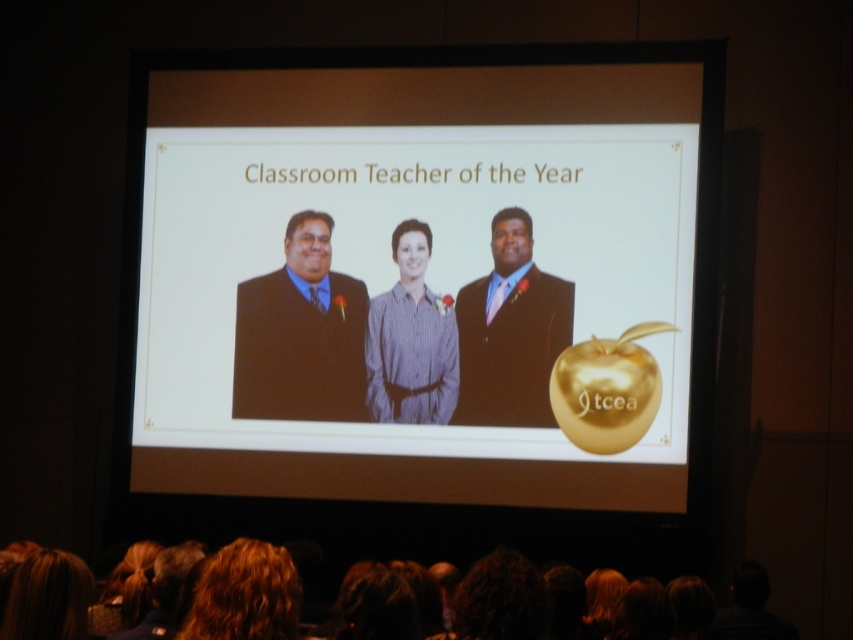
Question: Considering the real-world distances, which object is closest to the curly brown hair at lower center?

Choices:
 (A) brown suit at center
 (B) black suit at center

Answer: (B)

Question: Based on their relative distances, which object is nearer to the blue striped shirt at center?

Choices:
 (A) white paper at center
 (B) curly brown hair at lower center
 (C) brown suit at center

Answer: (C)

Question: Observing the image, what is the correct spatial positioning of white paper at center in reference to brown hair at lower left?

Choices:
 (A) below
 (B) above

Answer: (B)

Question: Which point is closer to the camera?

Choices:
 (A) (413, 225)
 (B) (22, 572)
 (C) (521, 275)
 (D) (711, 176)

Answer: (B)

Question: Is blue striped shirt at center bigger than curly brown hair at lower center?

Choices:
 (A) no
 (B) yes

Answer: (B)

Question: Is blue striped shirt at center further to camera compared to brown hair at lower left?

Choices:
 (A) no
 (B) yes

Answer: (B)